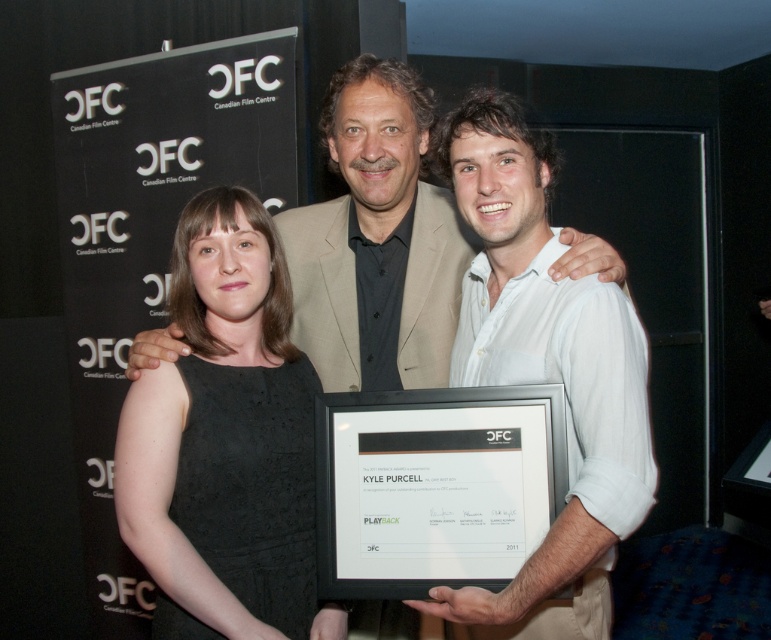
You are a GUI agent. You are given a task and a screenshot of the screen. Output one action in this format:
    pyautogui.click(x=<x>, y=<y>)
    Task: Click on the white shirt at center
    
    Given the screenshot: What is the action you would take?
    pyautogui.click(x=544, y=372)

Who is more distant from viewer, (443,129) or (453,541)?

The point (443,129) is behind.

Find the location of a particular element. This screenshot has height=640, width=771. white shirt at center is located at coordinates (544, 372).

Can you confirm if light beige suit at center is positioned above white paper at center?

Indeed, light beige suit at center is positioned over white paper at center.

Describe the element at coordinates (376, 240) in the screenshot. I see `light beige suit at center` at that location.

Does point (456, 268) come behind point (345, 593)?

Yes, it is.

Where is `light beige suit at center`? This screenshot has width=771, height=640. light beige suit at center is located at coordinates (376, 240).

Between point (482, 620) and point (403, 140), which one is positioned in front?

Point (482, 620) is more forward.

Can you confirm if white shirt at center is wider than light beige suit at center?

Incorrect, white shirt at center's width does not surpass light beige suit at center's.

The width and height of the screenshot is (771, 640). What are the coordinates of `white shirt at center` in the screenshot? It's located at (544, 372).